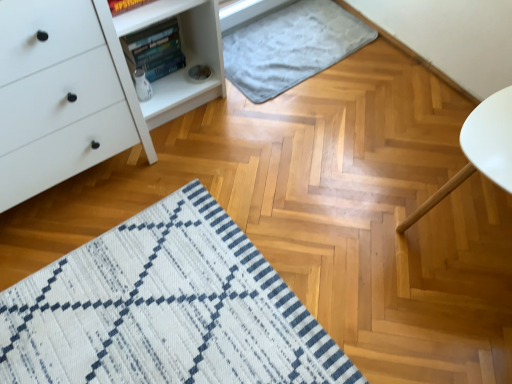
You are a GUI agent. You are given a task and a screenshot of the screen. Output one action in this format:
    pyautogui.click(x=<x>, y=<y>)
    Task: Click on the hardcover book at upper left
    This screenshot has height=384, width=512.
    Given the screenshot: What is the action you would take?
    pyautogui.click(x=155, y=50)

You are a GUI agent. You are given a task and a screenshot of the screen. Output one action in this format:
    pyautogui.click(x=<x>, y=<y>)
    Task: Click on the white matte table at right
    This screenshot has height=384, width=512.
    Given the screenshot: What is the action you would take?
    pyautogui.click(x=480, y=150)

Measure the distance between white matte chest of drawers at left and camera.

The distance of white matte chest of drawers at left from camera is 97.20 centimeters.

The height and width of the screenshot is (384, 512). What do you see at coordinates (290, 46) in the screenshot? I see `gray soft rug at upper center` at bounding box center [290, 46].

What is the approximate width of gray soft rug at upper center?

gray soft rug at upper center is 18.89 inches in width.

What are the coordinates of `hardcover book at upper left` in the screenshot? It's located at (155, 50).

Is gray soft rug at upper center looking in the opposite direction of hardcover book at upper left?

No, gray soft rug at upper center is not facing away from hardcover book at upper left.

Is gray soft rug at upper center to the left or to the right of hardcover book at upper left in the image?

gray soft rug at upper center is to the right of hardcover book at upper left.

You are a GUI agent. You are given a task and a screenshot of the screen. Output one action in this format:
    pyautogui.click(x=<x>, y=<y>)
    Task: Click on the blanket located behind the hardcover book at upper left
    This screenshot has width=512, height=384.
    Given the screenshot: What is the action you would take?
    pyautogui.click(x=290, y=46)

Can you tell me how much white matte chest of drawers at left and gray soft rug at upper center differ in facing direction?

0.807 degrees separate the facing orientations of white matte chest of drawers at left and gray soft rug at upper center.

Are white matte chest of drawers at left and gray soft rug at upper center beside each other?

No.

From a real-world perspective, between white matte chest of drawers at left and gray soft rug at upper center, who is vertically lower?

From a 3D spatial view, gray soft rug at upper center is below.

Does point (106, 29) appear closer or farther from the camera than point (293, 19)?

Clearly, point (106, 29) is closer to the camera than point (293, 19).

Which is nearer, [98,85] or [501,164]?

Point [98,85] is positioned farther from the camera compared to point [501,164].

Can you confirm if white matte chest of drawers at left is wider than white matte table at right?

Incorrect, the width of white matte chest of drawers at left does not surpass that of white matte table at right.

From a real-world perspective, is white matte chest of drawers at left under white matte table at right?

No, from a real-world perspective, white matte chest of drawers at left is not under white matte table at right.

Between hardcover book at upper left and gray soft rug at upper center, which one is positioned in front?

Positioned in front is hardcover book at upper left.

From the picture: Considering the relative sizes of hardcover book at upper left and gray soft rug at upper center in the image provided, is hardcover book at upper left taller than gray soft rug at upper center?

Yes, hardcover book at upper left is taller than gray soft rug at upper center.

Identify the location of blanket that is above the hardcover book at upper left (from the image's perspective). This screenshot has height=384, width=512. (290, 46).

Is hardcover book at upper left oriented away from gray soft rug at upper center?

No, gray soft rug at upper center is not at the back of hardcover book at upper left.

From a real-world perspective, is gray soft rug at upper center located higher than white matte chest of drawers at left?

No, from a real-world perspective, gray soft rug at upper center is not over white matte chest of drawers at left

Would you say gray soft rug at upper center is a long distance from white matte chest of drawers at left?

No, gray soft rug at upper center is in close proximity to white matte chest of drawers at left.

Based on the photo, does gray soft rug at upper center have a lesser height compared to white matte chest of drawers at left?

Correct, gray soft rug at upper center is not as tall as white matte chest of drawers at left.

Is gray soft rug at upper center aimed at white matte chest of drawers at left?

No, gray soft rug at upper center does not turn towards white matte chest of drawers at left.

Which object is positioned more to the left, hardcover book at upper left or white matte chest of drawers at left?

Positioned to the left is white matte chest of drawers at left.

Is hardcover book at upper left situated inside white matte chest of drawers at left or outside?

The correct answer is: outside.

Which of these two, hardcover book at upper left or white matte chest of drawers at left, is thinner?

hardcover book at upper left is thinner.

Could you tell me if white matte table at right is facing gray soft rug at upper center?

No, white matte table at right is not oriented towards gray soft rug at upper center.

From a real-world perspective, does white matte table at right stand above gray soft rug at upper center?

Yes, from a real-world perspective, white matte table at right is over gray soft rug at upper center

Which is less distant, [397,227] or [298,15]?

Point [397,227] is positioned closer to the camera compared to point [298,15].

Is white matte table at right surrounding gray soft rug at upper center?

No, gray soft rug at upper center is not a part of white matte table at right.

What are the coordinates of `blanket that is under the hardcover book at upper left (from a real-world perspective)` in the screenshot? It's located at (290, 46).

Image resolution: width=512 pixels, height=384 pixels. I want to click on chest of drawers on the left of gray soft rug at upper center, so click(60, 96).

Estimate the real-world distances between objects in this image. Which object is further from white matte table at right, hardcover book at upper left or white matte chest of drawers at left?

hardcover book at upper left.

Based on their spatial positions, is gray soft rug at upper center or white matte table at right closer to hardcover book at upper left?

Among the two, gray soft rug at upper center is located nearer to hardcover book at upper left.

Looking at the image, which one is located closer to hardcover book at upper left, gray soft rug at upper center or white matte chest of drawers at left?

The object closer to hardcover book at upper left is white matte chest of drawers at left.

Based on their spatial positions, is white matte chest of drawers at left or hardcover book at upper left closer to white matte table at right?

Based on the image, white matte chest of drawers at left appears to be nearer to white matte table at right.

Based on their spatial positions, is gray soft rug at upper center or white matte chest of drawers at left closer to white matte table at right?

Among the two, gray soft rug at upper center is located nearer to white matte table at right.

In the scene shown: Based on their spatial positions, is white matte chest of drawers at left or white matte table at right further from gray soft rug at upper center?

white matte table at right is positioned further to the anchor gray soft rug at upper center.

Which object lies further to the anchor point white matte chest of drawers at left, hardcover book at upper left or white matte table at right?

white matte table at right lies further to white matte chest of drawers at left than the other object.

Based on the photo, considering their positions, is gray soft rug at upper center positioned further to white matte chest of drawers at left than white matte table at right?

white matte table at right is further to white matte chest of drawers at left.

What are the coordinates of `book located between white matte chest of drawers at left and gray soft rug at upper center in the depth direction` in the screenshot? It's located at (155, 50).

Locate an element on the screen. blanket between hardcover book at upper left and white matte table at right in the horizontal direction is located at coordinates (290, 46).

You are a GUI agent. You are given a task and a screenshot of the screen. Output one action in this format:
    pyautogui.click(x=<x>, y=<y>)
    Task: Click on the blanket between white matte chest of drawers at left and white matte table at right in the horizontal direction
    This screenshot has height=384, width=512.
    Given the screenshot: What is the action you would take?
    pyautogui.click(x=290, y=46)

Where is `book between white matte chest of drawers at left and white matte table at right`? book between white matte chest of drawers at left and white matte table at right is located at coordinates pos(155,50).